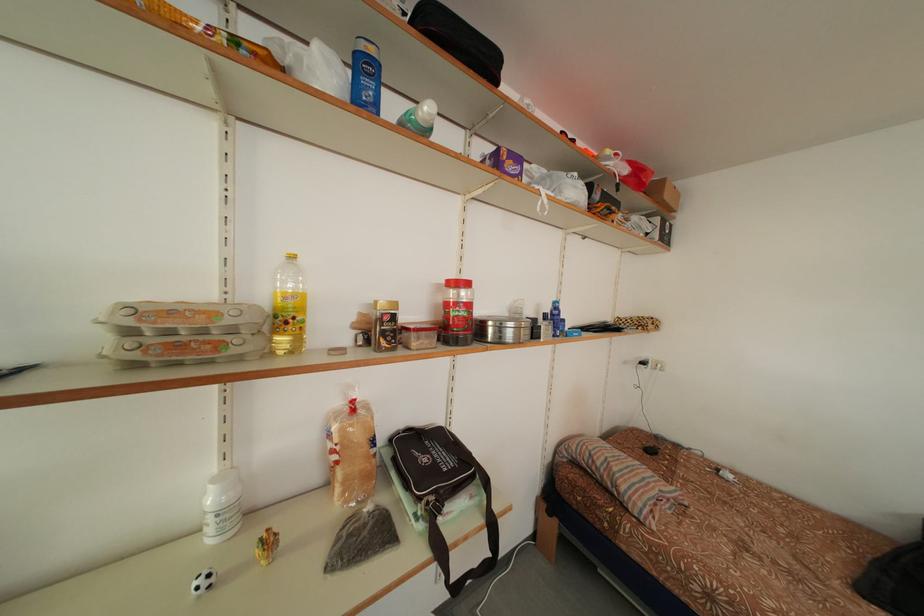
Locate an element on the screen. yellow bottle cap is located at coordinates (290, 254).